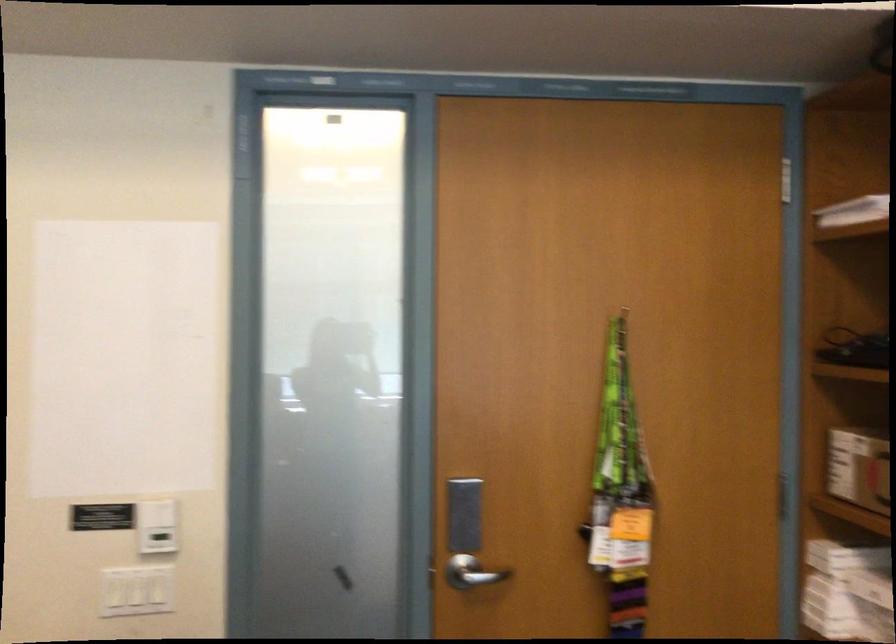
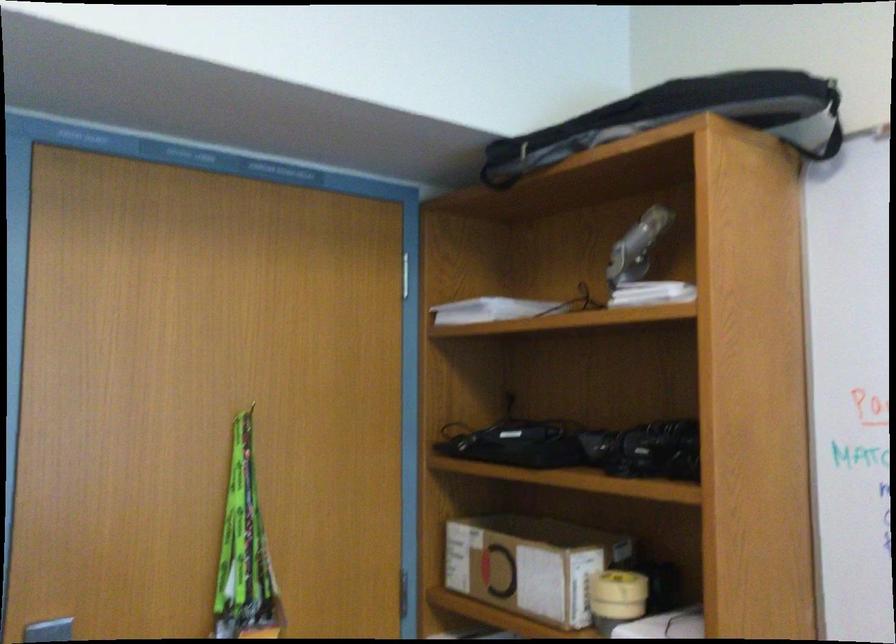
In the second image, find the point that corresponds to point 621,444 in the first image.

(244, 547)